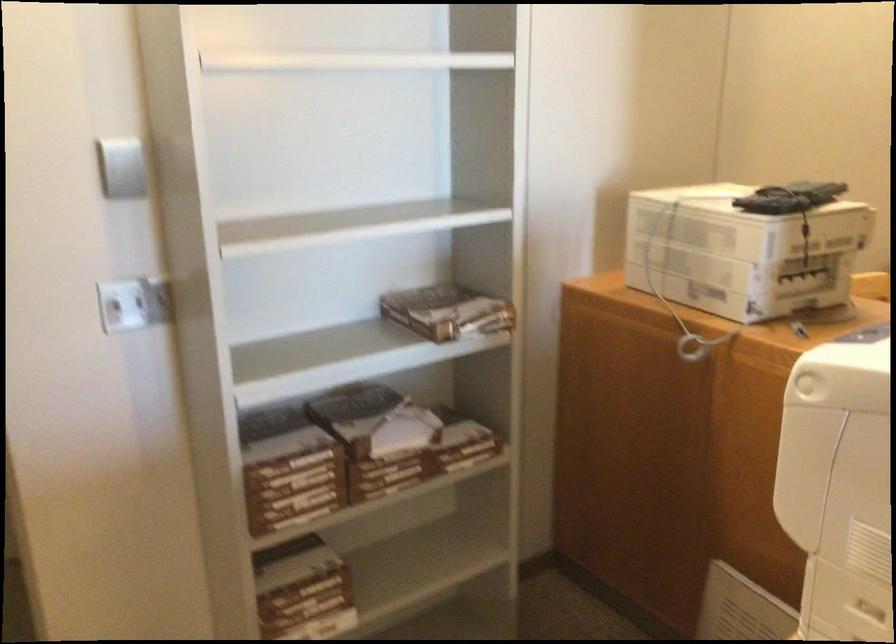
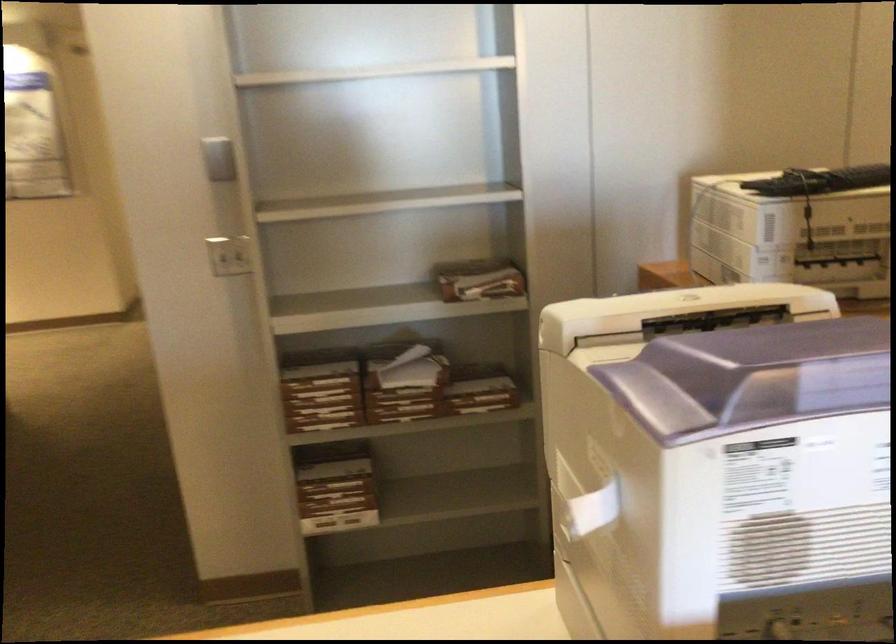
Where in the second image is the point corresponding to [122,308] from the first image?

(228, 254)